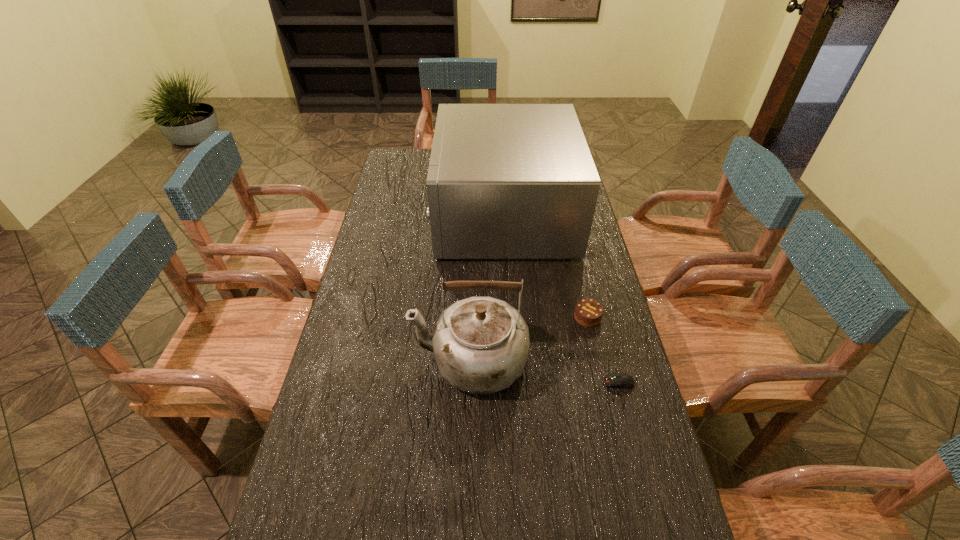
You are a GUI agent. You are given a task and a screenshot of the screen. Output one action in this format:
    pyautogui.click(x=<x>, y=<y>)
    Task: Click on the microwave oven
    
    Given the screenshot: What is the action you would take?
    pyautogui.click(x=505, y=181)

This screenshot has width=960, height=540. What are the coordinates of `kettle` in the screenshot? It's located at (480, 344).

You are a GUI agent. You are given a task and a screenshot of the screen. Output one action in this format:
    pyautogui.click(x=<x>, y=<y>)
    Task: Click on the chocolate cake
    This screenshot has width=960, height=540.
    Given the screenshot: What is the action you would take?
    pyautogui.click(x=588, y=312)

Find the location of a particular element. This screenshot has width=960, height=540. computer equipment is located at coordinates (620, 380).

Locate an element on the screen. This screenshot has height=540, width=960. vacant region located with the door open on the microwave oven is located at coordinates (379, 214).

The height and width of the screenshot is (540, 960). What are the coordinates of `free spot located 0.140m with the door open on the microwave oven` in the screenshot? It's located at coord(401,214).

This screenshot has width=960, height=540. I want to click on vacant space located 0.190m with the door open on the microwave oven, so click(x=390, y=214).

Identify the location of vacant space located 0.180m at the spout of the kettle. (351, 360).

Image resolution: width=960 pixels, height=540 pixels. Find the location of `vacant space located 0.170m at the spout of the kettle`. vacant space located 0.170m at the spout of the kettle is located at coordinates pyautogui.click(x=354, y=360).

Identify the location of vacant space located at the spout of the kettle. The width and height of the screenshot is (960, 540). pos(375,360).